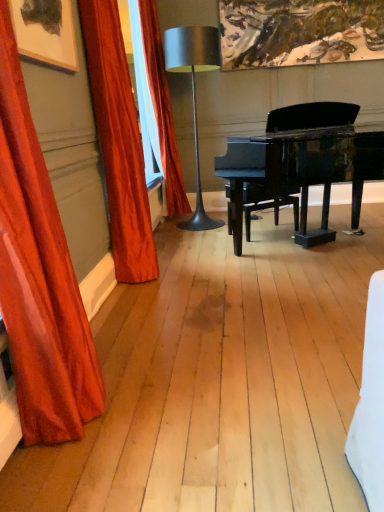
The height and width of the screenshot is (512, 384). In order to click on free location in front of satin red curtain at left, acting as the 1th curtain starting from the front in this screenshot , I will do `click(86, 475)`.